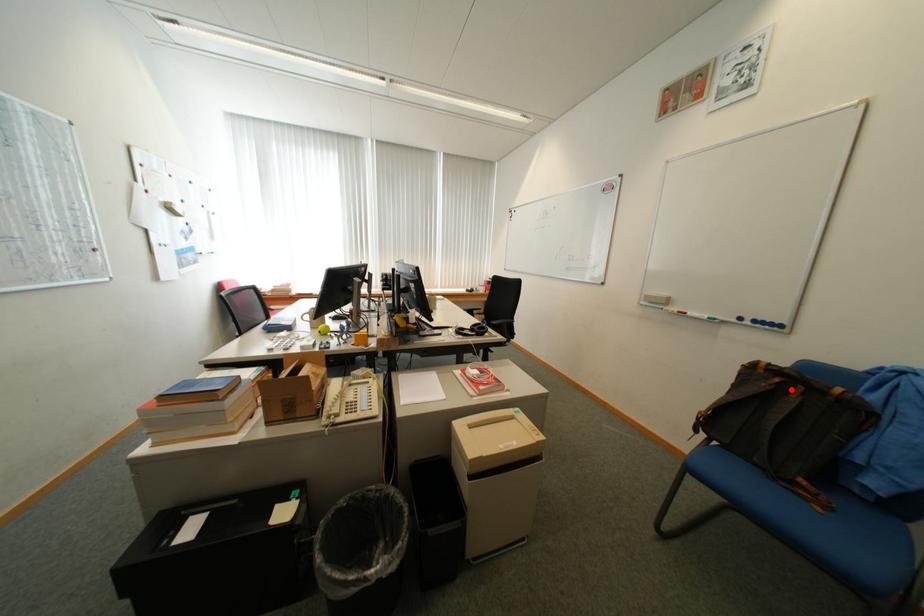
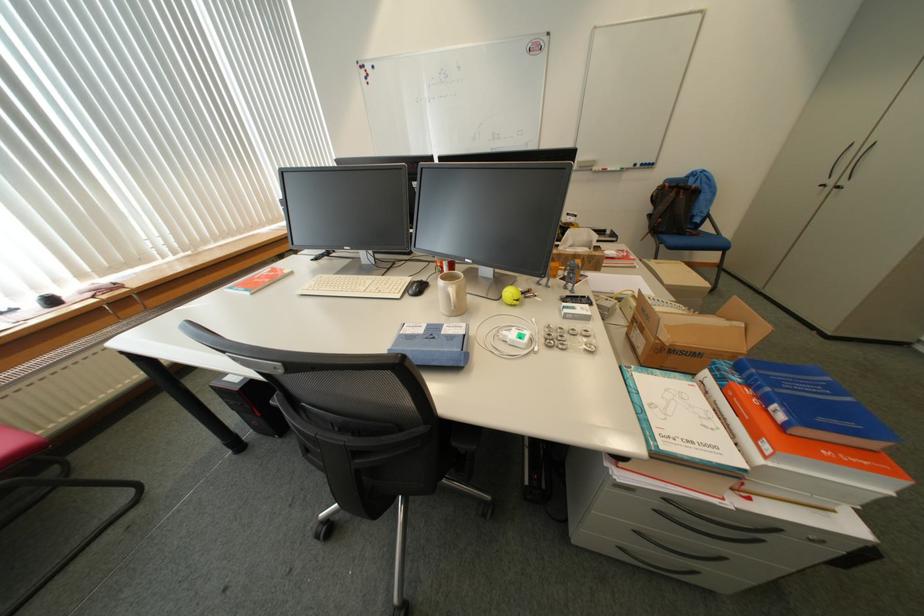
Locate, in the second image, the point that corresponds to the highlighted location in the first image.

(687, 195)